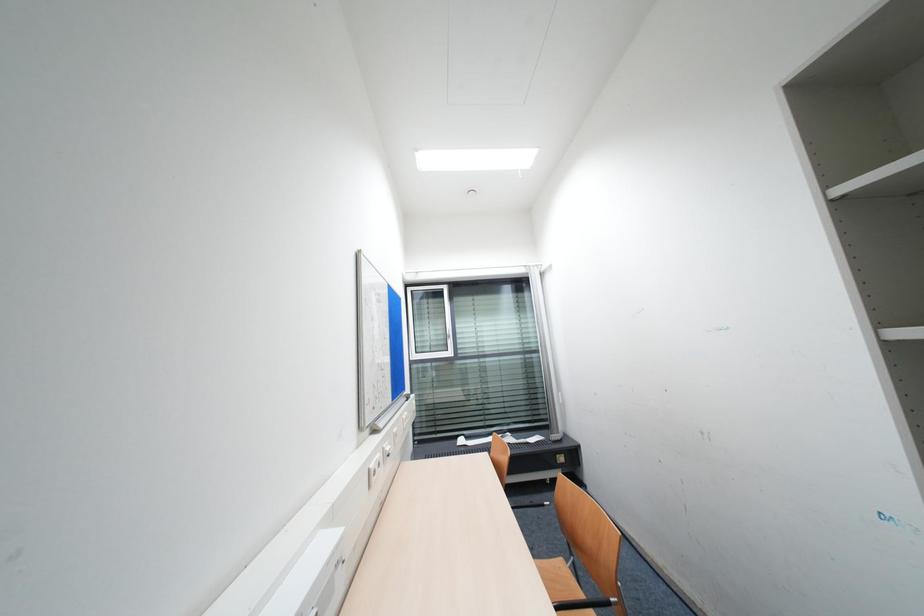
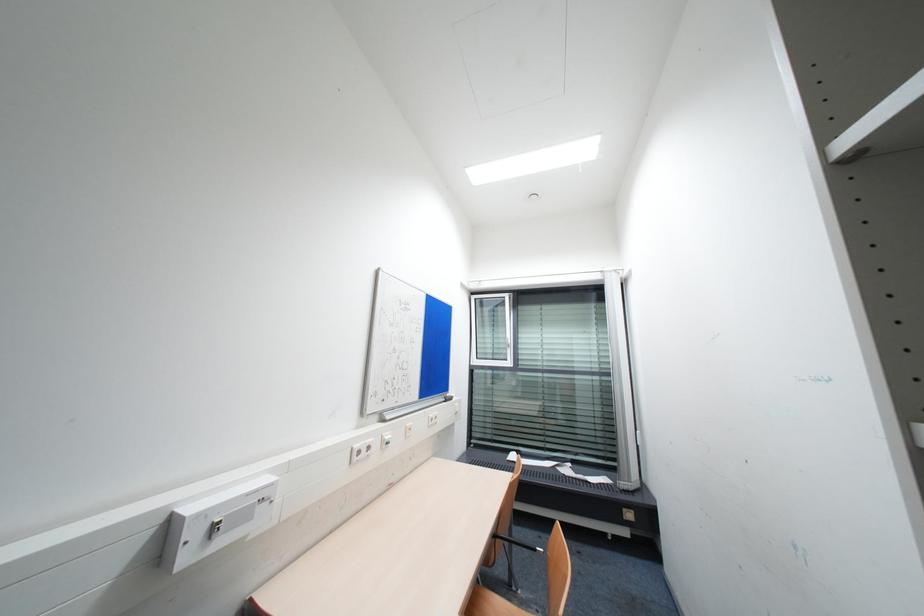
Question: The images are taken continuously from a first-person perspective. In which direction is your viewpoint rotating?

Choices:
 (A) Left
 (B) Right
 (C) Up
 (D) Down

Answer: (A)